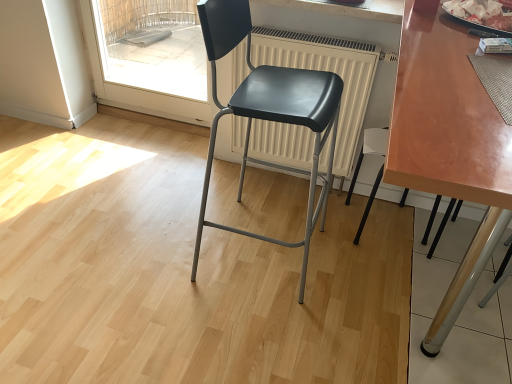
Where is `free space on the front side of matte black chair at lower right, marked as the 1th chair in a right-to-left arrangement`? The image size is (512, 384). free space on the front side of matte black chair at lower right, marked as the 1th chair in a right-to-left arrangement is located at coordinates (394, 283).